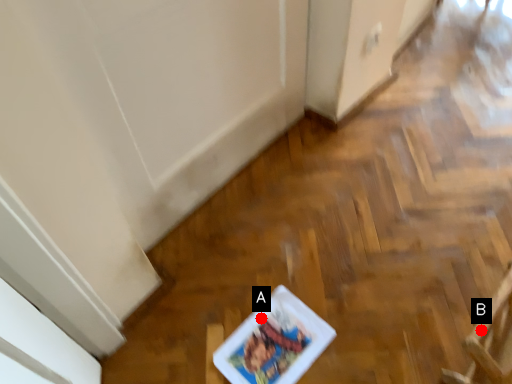
Question: Two points are circled on the image, labeled by A and B beside each circle. Among these points, which one is farthest from the camera?

Choices:
 (A) A is further
 (B) B is further

Answer: (A)